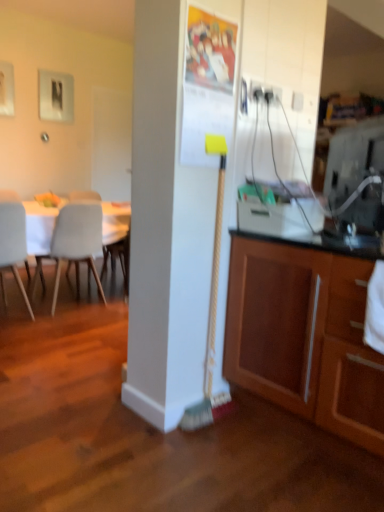
Where is `light gray plastic chair at left, the first chair from the right`? Image resolution: width=384 pixels, height=512 pixels. light gray plastic chair at left, the first chair from the right is located at coordinates (74, 244).

At what (x,y) coordinates should I click in order to perform the action: click on white matte chair at left, which is counted as the first chair, starting from the left. Please return your answer as a coordinate pair (x, y). The width and height of the screenshot is (384, 512). Looking at the image, I should click on (13, 245).

The image size is (384, 512). Find the location of `wooden cabinet at lower right`. wooden cabinet at lower right is located at coordinates (304, 335).

Find the location of `light gray plastic chair at left, the first chair from the right`. light gray plastic chair at left, the first chair from the right is located at coordinates (74, 244).

Is point (215, 291) farther from viewer compared to point (72, 231)?

That is False.

Visually, is yellow-bristled broom at center positioned to the left or to the right of light gray plastic chair at left, the first chair from the right?

yellow-bristled broom at center is to the right of light gray plastic chair at left, the first chair from the right.

I want to click on the 1st chair positioned below the yellow-bristled broom at center (from a real-world perspective), so click(74, 244).

Is yellow-bristled broom at center oriented away from light gray plastic chair at left, the first chair from the right?

That's right, yellow-bristled broom at center is facing away from light gray plastic chair at left, the first chair from the right.

Which object is thinner, white matte chair at left, which is counted as the 2th chair, starting from the right, or wooden cabinet at lower right?

white matte chair at left, which is counted as the 2th chair, starting from the right, is thinner.

Is white matte chair at left, which is counted as the 2th chair, starting from the right, not close to wooden cabinet at lower right?

Yes, white matte chair at left, which is counted as the 2th chair, starting from the right, is far from wooden cabinet at lower right.

From a real-world perspective, which is physically above, white matte chair at left, which is counted as the 2th chair, starting from the right, or wooden cabinet at lower right?

wooden cabinet at lower right, from a real-world perspective.

From the image's perspective, is white matte chair at left, which is counted as the first chair, starting from the left, beneath light gray plastic chair at left, the first chair from the right?

Yes.

Is white matte chair at left, which is counted as the 2th chair, starting from the right, turned away from light gray plastic chair at left, the first chair from the right?

No, white matte chair at left, which is counted as the 2th chair, starting from the right, is not facing away from light gray plastic chair at left, the first chair from the right.

From a real-world perspective, between white matte chair at left, which is counted as the first chair, starting from the left, and light gray plastic chair at left, the first chair from the right, who is vertically higher?

From a 3D spatial view, light gray plastic chair at left, the first chair from the right, is above.

In the scene shown: Is yellow-bristled broom at center positioned in front of white matte chair at left, which is counted as the 2th chair, starting from the right?

Yes, the depth of yellow-bristled broom at center is less than that of white matte chair at left, which is counted as the 2th chair, starting from the right.

In terms of size, does yellow-bristled broom at center appear bigger or smaller than white matte chair at left, which is counted as the first chair, starting from the left?

Clearly, yellow-bristled broom at center is smaller in size than white matte chair at left, which is counted as the first chair, starting from the left.

Between yellow-bristled broom at center and white matte chair at left, which is counted as the 2th chair, starting from the right, which one appears on the left side from the viewer's perspective?

white matte chair at left, which is counted as the 2th chair, starting from the right, is more to the left.

What's the angular difference between yellow-bristled broom at center and white matte chair at left, which is counted as the first chair, starting from the left,'s facing directions?

The angular difference between yellow-bristled broom at center and white matte chair at left, which is counted as the first chair, starting from the left, is 180 degrees.

At what (x,y) coordinates should I click in order to perform the action: click on chair that is the 2nd one when counting upward from the wooden cabinet at lower right (from the image's perspective). Please return your answer as a coordinate pair (x, y). Looking at the image, I should click on (74, 244).

Considering the sizes of objects light gray plastic chair at left, the first chair from the right, and wooden cabinet at lower right in the image provided, who is shorter, light gray plastic chair at left, the first chair from the right, or wooden cabinet at lower right?

light gray plastic chair at left, the first chair from the right.

Is light gray plastic chair at left, acting as the 2th chair starting from the left, aimed at wooden cabinet at lower right?

No, light gray plastic chair at left, acting as the 2th chair starting from the left, does not turn towards wooden cabinet at lower right.

Looking at their sizes, would you say light gray plastic chair at left, acting as the 2th chair starting from the left, is wider or thinner than wooden cabinet at lower right?

light gray plastic chair at left, acting as the 2th chair starting from the left, is thinner than wooden cabinet at lower right.

From the image's perspective, is light gray plastic chair at left, the first chair from the right, above or below yellow-bristled broom at center?

light gray plastic chair at left, the first chair from the right, is above yellow-bristled broom at center.

How many degrees apart are the facing directions of light gray plastic chair at left, the first chair from the right, and yellow-bristled broom at center?

The facing directions of light gray plastic chair at left, the first chair from the right, and yellow-bristled broom at center are 180 degrees apart.

Based on the photo, is light gray plastic chair at left, acting as the 2th chair starting from the left, shorter than yellow-bristled broom at center?

Yes, light gray plastic chair at left, acting as the 2th chair starting from the left, is shorter than yellow-bristled broom at center.

Looking at this image, which of these two, light gray plastic chair at left, acting as the 2th chair starting from the left, or yellow-bristled broom at center, is thinner?

With smaller width is yellow-bristled broom at center.

From the image's perspective, relative to yellow-bristled broom at center, is wooden cabinet at lower right above or below?

wooden cabinet at lower right is situated lower than yellow-bristled broom at center in the image.

Is wooden cabinet at lower right taller than yellow-bristled broom at center?

No.

Is wooden cabinet at lower right positioned beyond the bounds of yellow-bristled broom at center?

Yes.

From a real-world perspective, count 1st chairs downward from the yellow-bristled broom at center and point to it. Please provide its 2D coordinates.

[(74, 244)]

From the image's perspective, count 1st chairs upward from the wooden cabinet at lower right and point to it. Please provide its 2D coordinates.

[(13, 245)]

Estimate the real-world distances between objects in this image. Which object is closer to yellow-bristled broom at center, light gray plastic chair at left, acting as the 2th chair starting from the left, or white matte chair at left, which is counted as the first chair, starting from the left?

white matte chair at left, which is counted as the first chair, starting from the left, lies closer to yellow-bristled broom at center than the other object.

Which object lies nearer to the anchor point white matte chair at left, which is counted as the 2th chair, starting from the right, light gray plastic chair at left, acting as the 2th chair starting from the left, or yellow-bristled broom at center?

light gray plastic chair at left, acting as the 2th chair starting from the left, is closer to white matte chair at left, which is counted as the 2th chair, starting from the right.

Looking at the image, which one is located further to light gray plastic chair at left, the first chair from the right, yellow-bristled broom at center or white matte chair at left, which is counted as the first chair, starting from the left?

The object further to light gray plastic chair at left, the first chair from the right, is yellow-bristled broom at center.

Which object lies further to the anchor point wooden cabinet at lower right, yellow-bristled broom at center or white matte chair at left, which is counted as the first chair, starting from the left?

The object further to wooden cabinet at lower right is white matte chair at left, which is counted as the first chair, starting from the left.

Estimate the real-world distances between objects in this image. Which object is further from white matte chair at left, which is counted as the first chair, starting from the left, wooden cabinet at lower right or yellow-bristled broom at center?

Based on the image, wooden cabinet at lower right appears to be further to white matte chair at left, which is counted as the first chair, starting from the left.

Based on their spatial positions, is yellow-bristled broom at center or wooden cabinet at lower right closer to white matte chair at left, which is counted as the first chair, starting from the left?

yellow-bristled broom at center is positioned closer to the anchor white matte chair at left, which is counted as the first chair, starting from the left.

When comparing their distances from yellow-bristled broom at center, does wooden cabinet at lower right or white matte chair at left, which is counted as the first chair, starting from the left, seem closer?

wooden cabinet at lower right is closer to yellow-bristled broom at center.

Estimate the real-world distances between objects in this image. Which object is closer to white matte chair at left, which is counted as the first chair, starting from the left, light gray plastic chair at left, acting as the 2th chair starting from the left, or wooden cabinet at lower right?

light gray plastic chair at left, acting as the 2th chair starting from the left, is positioned closer to the anchor white matte chair at left, which is counted as the first chair, starting from the left.

At what (x,y) coordinates should I click in order to perform the action: click on brush between white matte chair at left, which is counted as the 2th chair, starting from the right, and wooden cabinet at lower right. Please return your answer as a coordinate pair (x, y). The height and width of the screenshot is (512, 384). Looking at the image, I should click on (210, 298).

This screenshot has height=512, width=384. Find the location of `brush between wooden cabinet at lower right and light gray plastic chair at left, the first chair from the right, from front to back`. brush between wooden cabinet at lower right and light gray plastic chair at left, the first chair from the right, from front to back is located at coordinates (210, 298).

I want to click on chair situated between white matte chair at left, which is counted as the first chair, starting from the left, and wooden cabinet at lower right from left to right, so click(74, 244).

Locate an element on the screen. chair located between white matte chair at left, which is counted as the first chair, starting from the left, and yellow-bristled broom at center in the left-right direction is located at coordinates (74, 244).